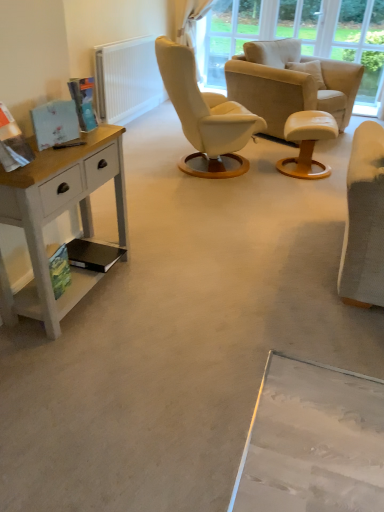
Locate an element on the screen. This screenshot has height=512, width=384. free spot behind white painted wood desk at left is located at coordinates (133, 233).